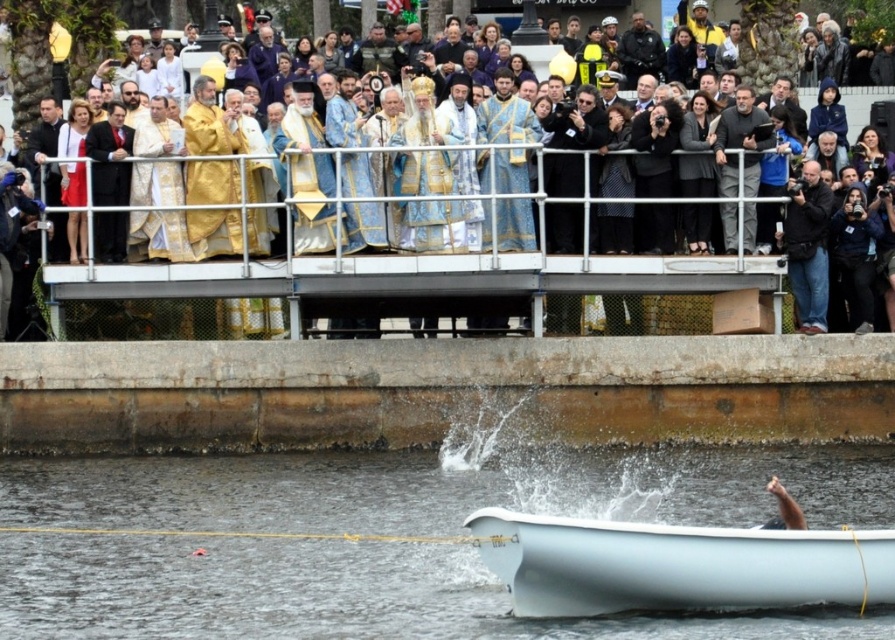
Question: In this image, where is black uniformed officer at upper center located relative to smooth white hand at lower right?

Choices:
 (A) below
 (B) above

Answer: (B)

Question: Can you confirm if clear water at boat right is thinner than white matte boat at lower center?

Choices:
 (A) yes
 (B) no

Answer: (B)

Question: Does black leather jacket at right appear on the left side of smooth white hand at lower right?

Choices:
 (A) yes
 (B) no

Answer: (B)

Question: Which point is farther to the camera?

Choices:
 (A) (175, 305)
 (B) (723, 193)
 (C) (652, 38)
 (D) (772, 476)

Answer: (C)

Question: Estimate the real-world distances between objects in this image. Which object is closer to the black leather jacket at right?

Choices:
 (A) black matte jacket at upper right
 (B) matte black people at upper center
 (C) clear water at boat right

Answer: (A)

Question: Which point is closer to the camera taking this photo?

Choices:
 (A) (791, 509)
 (B) (742, 156)
 (C) (663, 604)

Answer: (C)